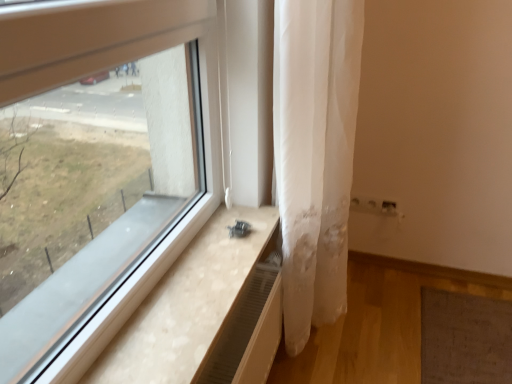
Question: Is white sheer curtain at center completely or partially outside of light wood/texture window sill at lower left?

Choices:
 (A) no
 (B) yes

Answer: (B)

Question: Could you tell me if white sheer curtain at center is facing light wood/texture window sill at lower left?

Choices:
 (A) yes
 (B) no

Answer: (B)

Question: Is white sheer curtain at center far from light wood/texture window sill at lower left?

Choices:
 (A) yes
 (B) no

Answer: (B)

Question: From the image's perspective, is white sheer curtain at center under light wood/texture window sill at lower left?

Choices:
 (A) yes
 (B) no

Answer: (B)

Question: Is white sheer curtain at center with light wood/texture window sill at lower left?

Choices:
 (A) no
 (B) yes

Answer: (A)

Question: Is white sheer curtain at center shorter than light wood/texture window sill at lower left?

Choices:
 (A) no
 (B) yes

Answer: (A)

Question: Is light wood/texture window sill at lower left located outside white sheer curtain at center?

Choices:
 (A) yes
 (B) no

Answer: (A)

Question: Is light wood/texture window sill at lower left to the left of white sheer curtain at center from the viewer's perspective?

Choices:
 (A) no
 (B) yes

Answer: (B)

Question: Is light wood/texture window sill at lower left smaller than white sheer curtain at center?

Choices:
 (A) no
 (B) yes

Answer: (B)

Question: Does light wood/texture window sill at lower left come behind white sheer curtain at center?

Choices:
 (A) no
 (B) yes

Answer: (A)

Question: From the image's perspective, is light wood/texture window sill at lower left beneath white sheer curtain at center?

Choices:
 (A) no
 (B) yes

Answer: (B)

Question: Can you confirm if light wood/texture window sill at lower left is wider than white sheer curtain at center?

Choices:
 (A) no
 (B) yes

Answer: (B)

Question: Is white sheer curtain at center bigger or smaller than light wood/texture window sill at lower left?

Choices:
 (A) big
 (B) small

Answer: (A)